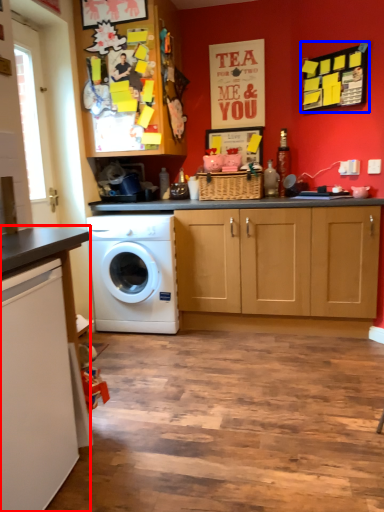
Question: Which of the following is the closest to the observer, countertop (highlighted by a red box) or bulletin board (highlighted by a blue box)?

Choices:
 (A) countertop
 (B) bulletin board

Answer: (A)